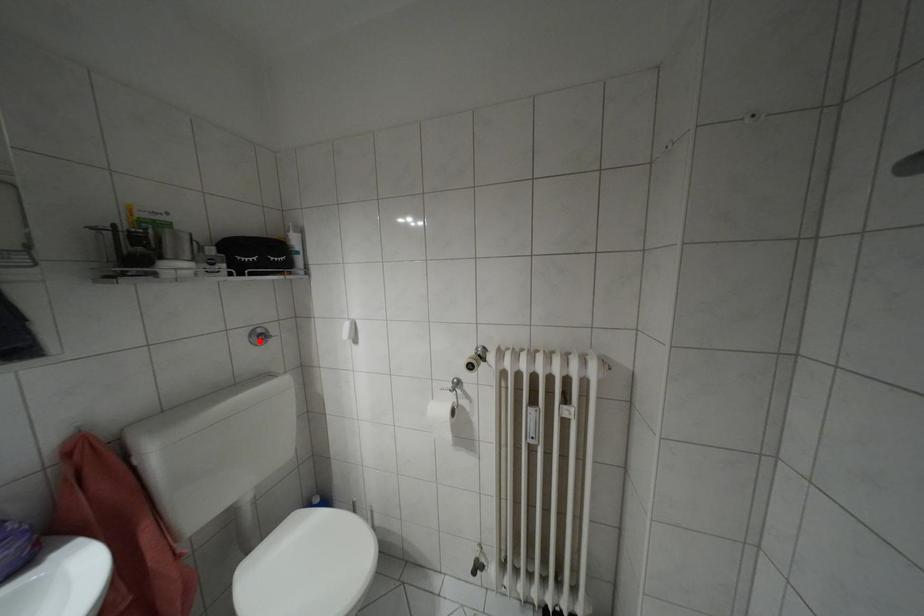
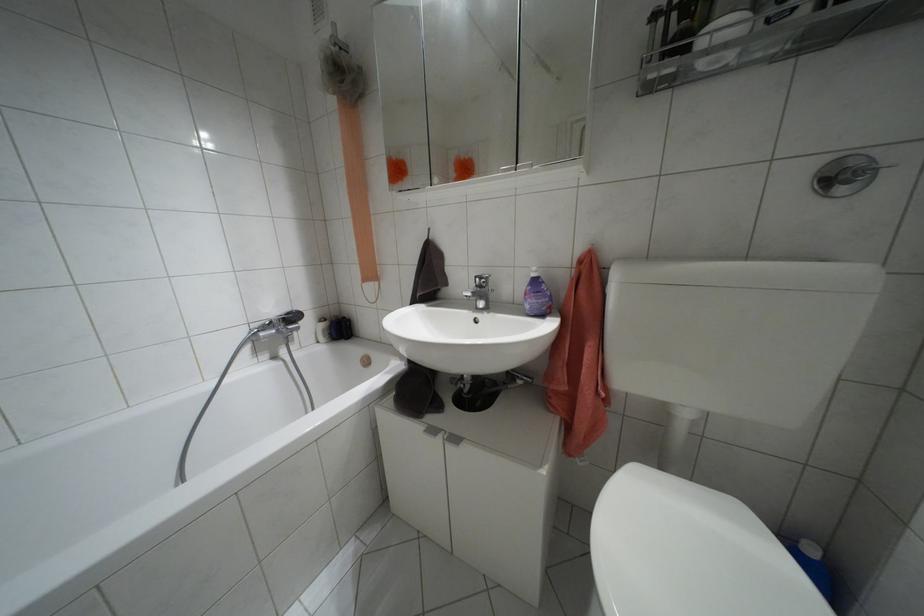
In the second image, find the point that corresponds to the highlighted location in the first image.

(841, 190)